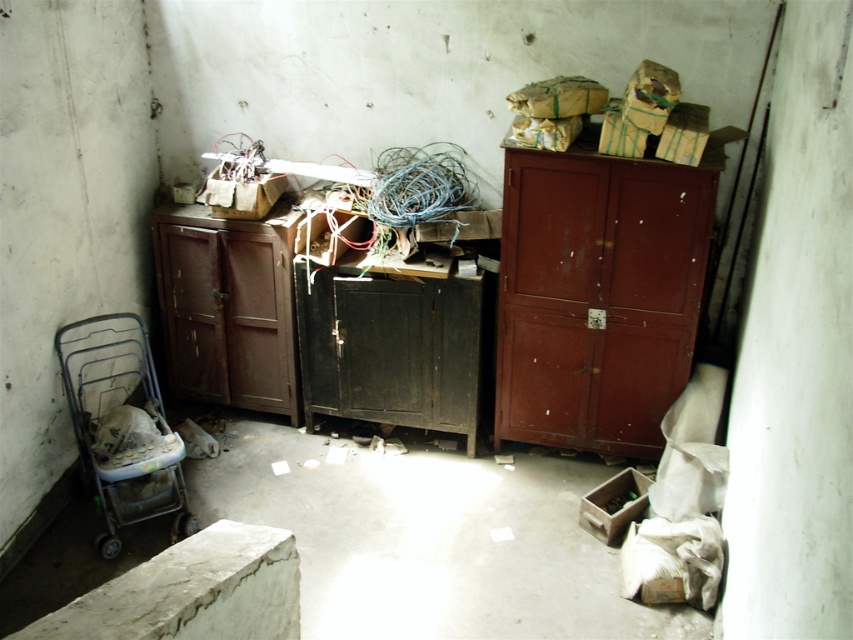
You are moving a metallic wireframe stroller at lower left into a space next to the matte wood cabinet at right. Can the stroller fit next to the cabinet without overlapping?

The matte wood cabinet at right might be wider than metallic wireframe stroller at lower left, so there is a possibility that the stroller can fit next to the cabinet without overlapping, but it depends on the exact dimensions.

You are moving a metallic wireframe stroller at lower left into a new apartment and need to fit it through a doorway that is 2 feet wider than the matte brown cabinet at center. Can the stroller fit through the doorway?

The matte brown cabinet at center has a smaller size compared to metallic wireframe stroller at lower left. Since the doorway is 2 feet wider than the cabinet, the stroller should fit as it is larger but within the doorway width.